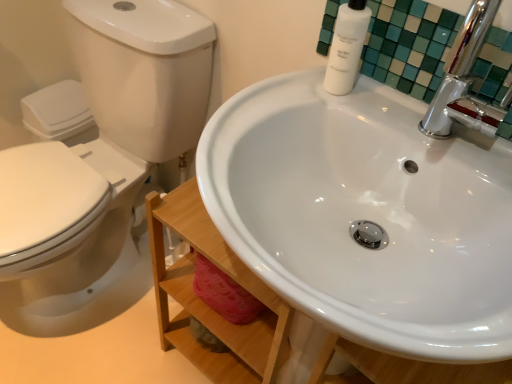
Question: Is white glossy toilet at left far from white glossy bottle at upper right?

Choices:
 (A) no
 (B) yes

Answer: (A)

Question: Considering the relative positions of white glossy toilet at left and white glossy bottle at upper right in the image provided, is white glossy toilet at left in front of white glossy bottle at upper right?

Choices:
 (A) yes
 (B) no

Answer: (A)

Question: Is white glossy toilet at left turned away from white glossy bottle at upper right?

Choices:
 (A) no
 (B) yes

Answer: (A)

Question: Could you tell me if white glossy toilet at left is turned towards white glossy bottle at upper right?

Choices:
 (A) yes
 (B) no

Answer: (B)

Question: Is white glossy toilet at left at the left side of white glossy bottle at upper right?

Choices:
 (A) yes
 (B) no

Answer: (A)

Question: From the image's perspective, is white matte bottle at upper right above or below white glossy bottle at upper right?

Choices:
 (A) above
 (B) below

Answer: (A)

Question: Is white matte bottle at upper right wider or thinner than white glossy bottle at upper right?

Choices:
 (A) thin
 (B) wide

Answer: (B)

Question: Considering the positions of white matte bottle at upper right and white glossy bottle at upper right in the image, is white matte bottle at upper right bigger or smaller than white glossy bottle at upper right?

Choices:
 (A) big
 (B) small

Answer: (B)

Question: From a real-world perspective, relative to white glossy bottle at upper right, is white matte bottle at upper right vertically above or below?

Choices:
 (A) above
 (B) below

Answer: (A)

Question: In terms of height, does white glossy sink at center look taller or shorter compared to white glossy bottle at upper right?

Choices:
 (A) tall
 (B) short

Answer: (A)

Question: Is point (396, 193) positioned closer to the camera than point (490, 97)?

Choices:
 (A) closer
 (B) farther

Answer: (B)

Question: In the image, is white glossy sink at center positioned in front of or behind white glossy bottle at upper right?

Choices:
 (A) front
 (B) behind

Answer: (A)

Question: Choose the correct answer: Is white glossy sink at center inside white glossy bottle at upper right or outside it?

Choices:
 (A) outside
 (B) inside

Answer: (A)

Question: From a real-world perspective, relative to white matte bottle at upper right, is white glossy toilet at left vertically above or below?

Choices:
 (A) above
 (B) below

Answer: (B)

Question: Visually, is white glossy toilet at left positioned to the left or to the right of white matte bottle at upper right?

Choices:
 (A) left
 (B) right

Answer: (A)